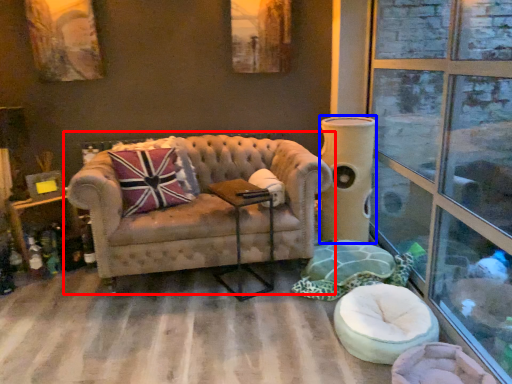
Question: Among these objects, which one is nearest to the camera, studio couch (highlighted by a red box) or pillar (highlighted by a blue box)?

Choices:
 (A) studio couch
 (B) pillar

Answer: (A)